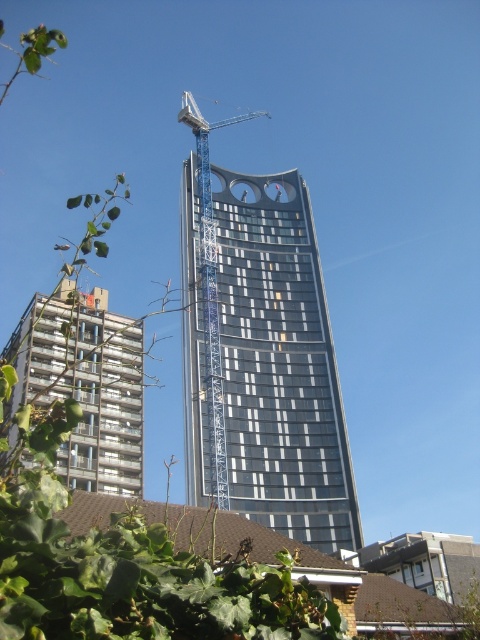
Question: Does glassy steel tower at center come in front of blue metallic crane at center?

Choices:
 (A) no
 (B) yes

Answer: (A)

Question: Can you confirm if glassy steel tower at center is positioned to the right of metallic silver building at lower left?

Choices:
 (A) yes
 (B) no

Answer: (A)

Question: Which point appears farthest from the camera in this image?

Choices:
 (A) (69, 394)
 (B) (336, 472)
 (C) (202, 125)

Answer: (C)

Question: Which point is closer to the camera?

Choices:
 (A) metallic silver building at lower left
 (B) blue metallic crane at center

Answer: (A)

Question: Does metallic silver building at lower left have a smaller size compared to blue metallic crane at center?

Choices:
 (A) no
 (B) yes

Answer: (B)

Question: Which point is farther from the camera taking this photo?

Choices:
 (A) (324, 524)
 (B) (207, 134)
 (C) (64, 470)

Answer: (B)